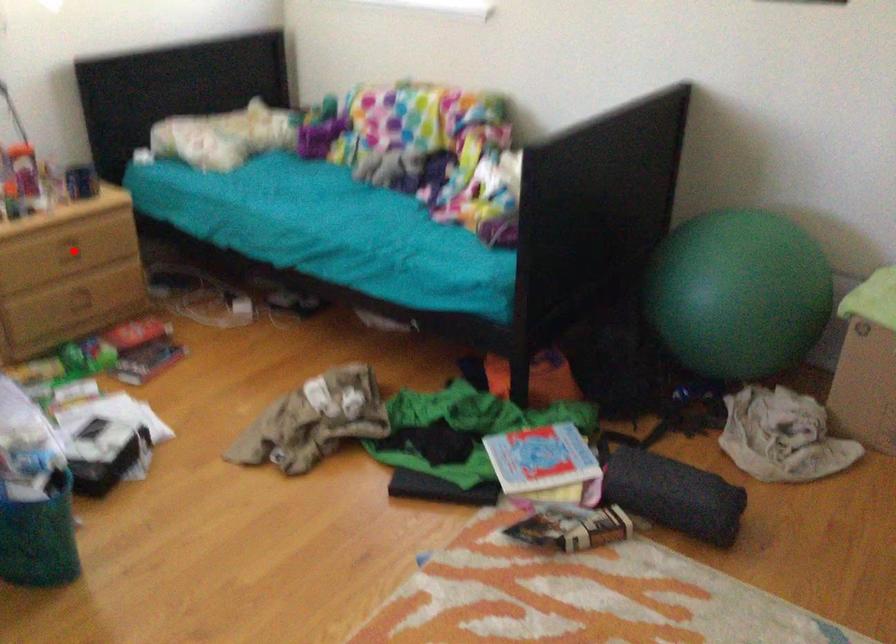
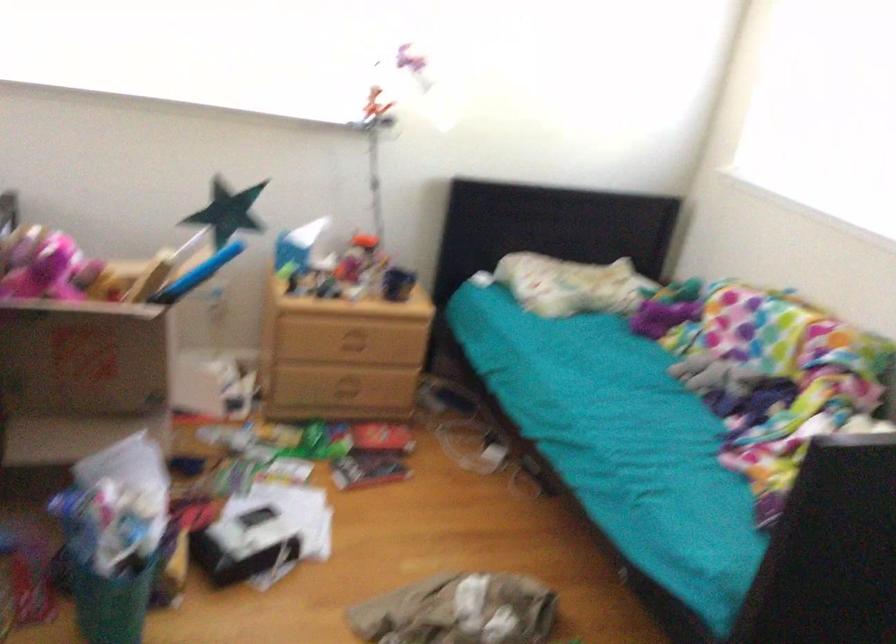
The point at the highlighted location is marked in the first image. Where is the corresponding point in the second image?

(352, 343)